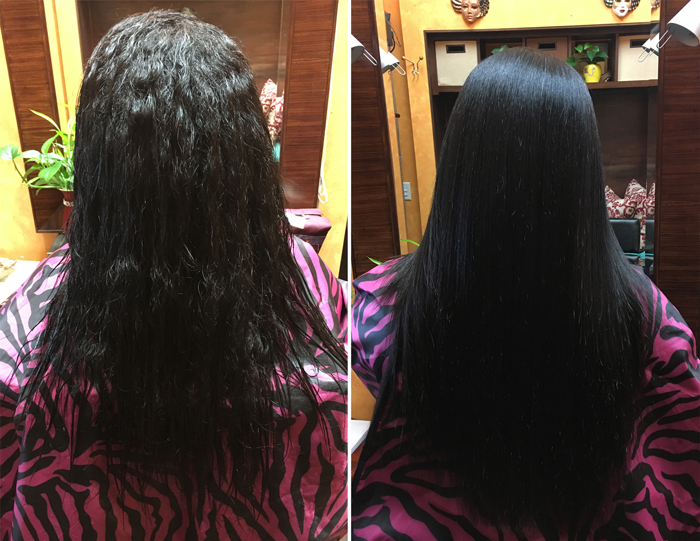
Locate an element on the screen. bookshelf is located at coordinates (656, 105).